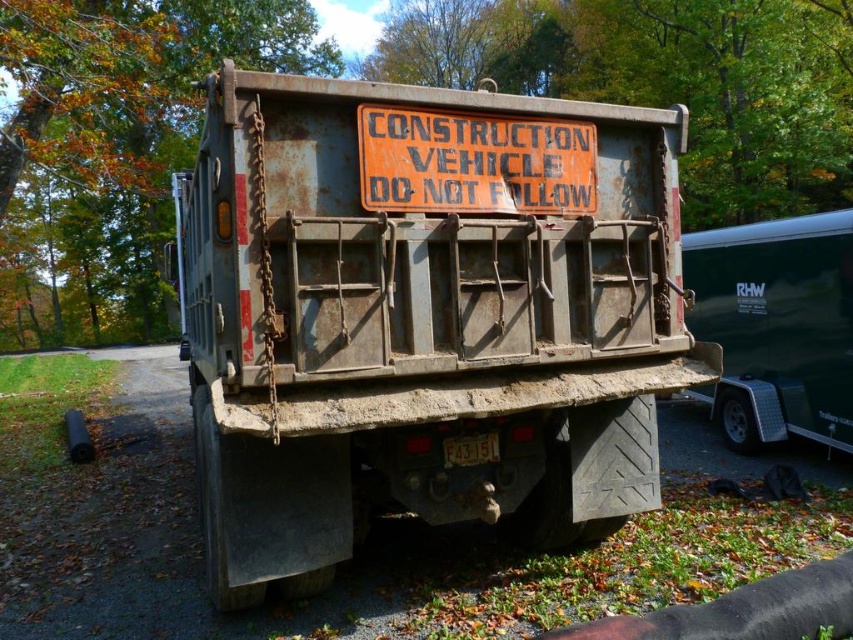
Does metallic trailer at right have a lesser width compared to orange weathered sign at center?

Indeed, metallic trailer at right has a lesser width compared to orange weathered sign at center.

Does metallic trailer at right appear over orange weathered sign at center?

Actually, metallic trailer at right is below orange weathered sign at center.

Does point (734, 310) come in front of point (424, 145)?

No, (734, 310) is behind (424, 145).

The width and height of the screenshot is (853, 640). What are the coordinates of `metallic trailer at right` in the screenshot? It's located at (776, 326).

Who is positioned more to the right, rusty metal construction vehicle at center or orange weathered sign at center?

orange weathered sign at center is more to the right.

Is point (289, 218) positioned before point (438, 182)?

Yes, it is in front of point (438, 182).

Is point (566, 176) positioned behind point (485, 168)?

Yes, point (566, 176) is farther from viewer.

Find the location of a particular element. rusty metal construction vehicle at center is located at coordinates (422, 316).

Does rusty metal construction vehicle at center have a greater height compared to metallic trailer at right?

Yes, rusty metal construction vehicle at center is taller than metallic trailer at right.

Does rusty metal construction vehicle at center come in front of metallic trailer at right?

Yes, rusty metal construction vehicle at center is in front of metallic trailer at right.

Which is in front, point (294, 474) or point (822, 221)?

Positioned in front is point (294, 474).

Find the location of `rusty metal construction vehicle at center`. rusty metal construction vehicle at center is located at coordinates tap(422, 316).